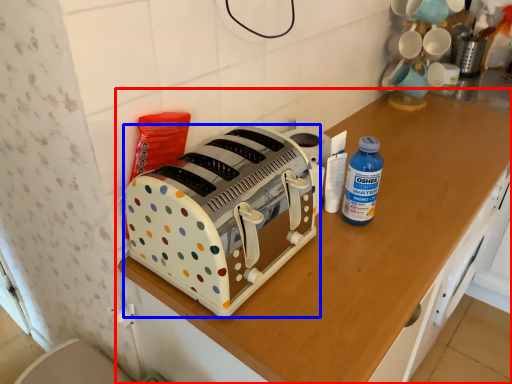
Question: Which point is further to the camera, cabinetry (highlighted by a red box) or toaster (highlighted by a blue box)?

Choices:
 (A) cabinetry
 (B) toaster

Answer: (B)